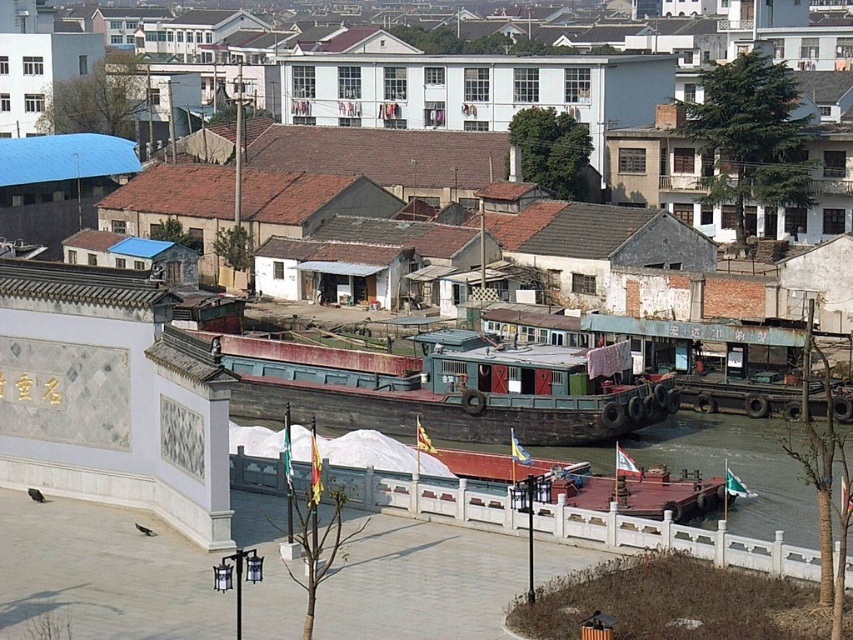
Can you confirm if rusty wooden barge at center is positioned to the right of smooth brown water at lower right?

No, rusty wooden barge at center is not to the right of smooth brown water at lower right.

Between rusty wooden barge at center and smooth brown water at lower right, which one has more height?

With more height is rusty wooden barge at center.

Where is `rusty wooden barge at center`? rusty wooden barge at center is located at coordinates (445, 388).

Image resolution: width=853 pixels, height=640 pixels. Find the location of `rusty wooden barge at center`. rusty wooden barge at center is located at coordinates (445, 388).